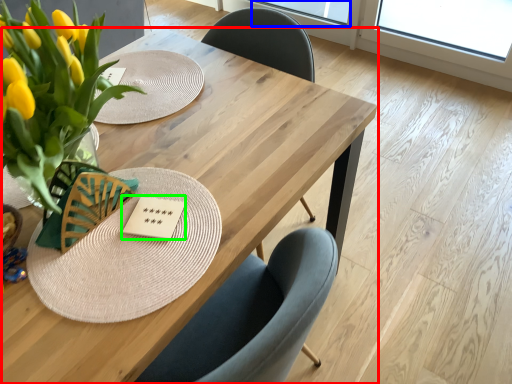
Question: Which object is positioned closest to table (highlighted by a red box)? Select from window screen (highlighted by a blue box) and card game (highlighted by a green box).

Choices:
 (A) window screen
 (B) card game

Answer: (B)